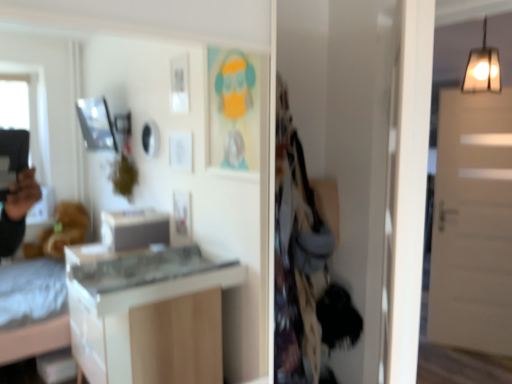
This screenshot has height=384, width=512. In order to click on matte glass pendant light at upper right in this screenshot , I will do `click(482, 68)`.

The image size is (512, 384). Describe the element at coordinates (482, 68) in the screenshot. I see `matte glass pendant light at upper right` at that location.

Find the location of `matte glass pendant light at upper right`. matte glass pendant light at upper right is located at coordinates (482, 68).